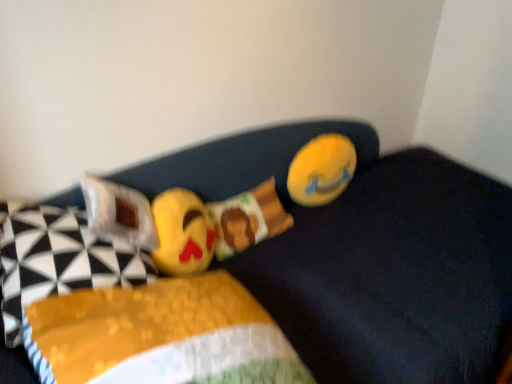
Where is `yellow fabric pillow at center`? The image size is (512, 384). yellow fabric pillow at center is located at coordinates pos(368,256).

Describe the element at coordinates (57, 260) in the screenshot. I see `yellow fabric pillow at left, which is counted as the 2th pillow, starting from the right` at that location.

Where is `yellow fabric pillow at left, marked as the 1th pillow in a left-to-right arrangement`? This screenshot has height=384, width=512. yellow fabric pillow at left, marked as the 1th pillow in a left-to-right arrangement is located at coordinates (57, 260).

At what (x,y) coordinates should I click in order to perform the action: click on yellow fabric pillow at center. Please return your answer as a coordinate pair (x, y). This screenshot has height=384, width=512. Looking at the image, I should click on (368, 256).

Is yellow fabric pillow at left, which is counted as the 2th pillow, starting from the right, next to yellow fabric pillow at center?

No, yellow fabric pillow at left, which is counted as the 2th pillow, starting from the right, is not with yellow fabric pillow at center.

From a real-world perspective, is yellow fabric pillow at left, marked as the 1th pillow in a left-to-right arrangement, under yellow fabric pillow at center?

Actually, yellow fabric pillow at left, marked as the 1th pillow in a left-to-right arrangement, is physically above yellow fabric pillow at center in the real world.

Considering the relative positions of yellow fabric pillow at left, which is counted as the 2th pillow, starting from the right, and yellow fabric pillow at center in the image provided, is yellow fabric pillow at left, which is counted as the 2th pillow, starting from the right, behind yellow fabric pillow at center?

Yes.

Is yellow fabric pillow at left, marked as the 1th pillow in a left-to-right arrangement, located outside yellow fabric pillow at center?

Actually, yellow fabric pillow at left, marked as the 1th pillow in a left-to-right arrangement, is within yellow fabric pillow at center.

Is soft plush emoji at center, which is the 2th toy in right-to-left order, not close to white fabric pillow at left, marked as the 1th pillow in a right-to-left arrangement?

Actually, soft plush emoji at center, which is the 2th toy in right-to-left order, and white fabric pillow at left, marked as the 1th pillow in a right-to-left arrangement, are a little close together.

From the image's perspective, which one is positioned higher, soft plush emoji at center, which is the 2th toy in right-to-left order, or white fabric pillow at left, marked as the 1th pillow in a right-to-left arrangement?

white fabric pillow at left, marked as the 1th pillow in a right-to-left arrangement, from the image's perspective.

Based on the photo, can you tell me how much soft plush emoji at center, the second toy positioned from the back, and white fabric pillow at left, which is counted as the 2th pillow, starting from the left, differ in facing direction?

The facing directions of soft plush emoji at center, the second toy positioned from the back, and white fabric pillow at left, which is counted as the 2th pillow, starting from the left, are 71.8 degrees apart.

From the picture: Which is correct: soft plush emoji at center, the second toy positioned from the back, is inside white fabric pillow at left, which is counted as the 2th pillow, starting from the left, or outside of it?

soft plush emoji at center, the second toy positioned from the back, is not inside white fabric pillow at left, which is counted as the 2th pillow, starting from the left, it's outside.

From a real-world perspective, is white fabric pillow at left, which is counted as the 2th pillow, starting from the left, positioned under yellow fabric pillow at left, marked as the 1th pillow in a left-to-right arrangement, based on gravity?

Incorrect, from a real-world perspective, white fabric pillow at left, which is counted as the 2th pillow, starting from the left, is higher than yellow fabric pillow at left, marked as the 1th pillow in a left-to-right arrangement.

Is white fabric pillow at left, which is counted as the 2th pillow, starting from the left, oriented away from yellow fabric pillow at left, marked as the 1th pillow in a left-to-right arrangement?

Yes, white fabric pillow at left, which is counted as the 2th pillow, starting from the left, is positioned with its back facing yellow fabric pillow at left, marked as the 1th pillow in a left-to-right arrangement.

Measure the distance between white fabric pillow at left, which is counted as the 2th pillow, starting from the left, and yellow fabric pillow at left, which is counted as the 2th pillow, starting from the right.

A distance of 4.38 inches exists between white fabric pillow at left, which is counted as the 2th pillow, starting from the left, and yellow fabric pillow at left, which is counted as the 2th pillow, starting from the right.

Does white fabric pillow at left, marked as the 1th pillow in a right-to-left arrangement, have a smaller size compared to yellow fabric pillow at left, marked as the 1th pillow in a left-to-right arrangement?

Indeed, white fabric pillow at left, marked as the 1th pillow in a right-to-left arrangement, has a smaller size compared to yellow fabric pillow at left, marked as the 1th pillow in a left-to-right arrangement.

Is soft plush emoji at center, which ranks as the 1th toy in left-to-right order, in front of yellow plush toy at upper right, acting as the 2th toy starting from the front?

Yes, it is in front of yellow plush toy at upper right, acting as the 2th toy starting from the front.

From the image's perspective, is soft plush emoji at center, which ranks as the 1th toy in left-to-right order, over yellow plush toy at upper right, which is the 2th toy in left-to-right order?

Incorrect, from the image's perspective, soft plush emoji at center, which ranks as the 1th toy in left-to-right order, is lower than yellow plush toy at upper right, which is the 2th toy in left-to-right order.

Which is correct: soft plush emoji at center, which ranks as the 1th toy in left-to-right order, is inside yellow plush toy at upper right, the first toy viewed from the right, or outside of it?

soft plush emoji at center, which ranks as the 1th toy in left-to-right order, exists outside the volume of yellow plush toy at upper right, the first toy viewed from the right.

From a real-world perspective, who is located lower, soft plush emoji at center, which is the 2th toy in right-to-left order, or yellow plush toy at upper right, which is the 2th toy in left-to-right order?

yellow plush toy at upper right, which is the 2th toy in left-to-right order.

Consider the image. From a real-world perspective, between yellow fabric pillow at center and yellow plush toy at upper right, the 1th toy viewed from the back, who is vertically higher?

yellow plush toy at upper right, the 1th toy viewed from the back.

From the image's perspective, which is above, yellow fabric pillow at center or yellow plush toy at upper right, which is the 2th toy in left-to-right order?

From the image's view, yellow plush toy at upper right, which is the 2th toy in left-to-right order, is above.

How different are the orientations of yellow fabric pillow at center and yellow plush toy at upper right, the 1th toy viewed from the back, in degrees?

93.4 degrees.

Based on the photo, who is bigger, yellow fabric pillow at center or yellow plush toy at upper right, the first toy viewed from the right?

With larger size is yellow fabric pillow at center.

In the scene shown: Is yellow fabric pillow at center positioned far away from soft plush emoji at center, which is the 2th toy in right-to-left order?

No, yellow fabric pillow at center is in close proximity to soft plush emoji at center, which is the 2th toy in right-to-left order.

Is soft plush emoji at center, the second toy positioned from the back, at the back of yellow fabric pillow at center?

yellow fabric pillow at center does not have its back to soft plush emoji at center, the second toy positioned from the back.

From a real-world perspective, who is located lower, yellow fabric pillow at center or soft plush emoji at center, positioned as the 1th toy in front-to-back order?

From a 3D spatial view, yellow fabric pillow at center is below.

Which object is thinner, yellow fabric pillow at center or soft plush emoji at center, positioned as the 1th toy in front-to-back order?

soft plush emoji at center, positioned as the 1th toy in front-to-back order, is thinner.

Are yellow fabric pillow at left, marked as the 1th pillow in a left-to-right arrangement, and soft plush emoji at center, which ranks as the 1th toy in left-to-right order, far apart?

No, yellow fabric pillow at left, marked as the 1th pillow in a left-to-right arrangement, is in close proximity to soft plush emoji at center, which ranks as the 1th toy in left-to-right order.

Consider the image. Which object is further away from the camera taking this photo, yellow fabric pillow at left, marked as the 1th pillow in a left-to-right arrangement, or soft plush emoji at center, which is the 2th toy in right-to-left order?

soft plush emoji at center, which is the 2th toy in right-to-left order.

From the image's perspective, between yellow fabric pillow at left, marked as the 1th pillow in a left-to-right arrangement, and soft plush emoji at center, positioned as the 1th toy in front-to-back order, who is located below?

yellow fabric pillow at left, marked as the 1th pillow in a left-to-right arrangement, from the image's perspective.

Is yellow fabric pillow at left, which is counted as the 2th pillow, starting from the right, facing towards soft plush emoji at center, the second toy positioned from the back?

Yes, yellow fabric pillow at left, which is counted as the 2th pillow, starting from the right, is turned towards soft plush emoji at center, the second toy positioned from the back.

This screenshot has height=384, width=512. I want to click on furniture on the right of the yellow fabric pillow at left, which is counted as the 2th pillow, starting from the right, so click(x=368, y=256).

Where is `toy below the white fabric pillow at left, which is counted as the 2th pillow, starting from the left (from the image's perspective)`? toy below the white fabric pillow at left, which is counted as the 2th pillow, starting from the left (from the image's perspective) is located at coordinates (182, 233).

From the image, which object appears to be farther from yellow fabric pillow at left, which is counted as the 2th pillow, starting from the right, soft plush emoji at center, positioned as the 1th toy in front-to-back order, or white fabric pillow at left, which is counted as the 2th pillow, starting from the left?

soft plush emoji at center, positioned as the 1th toy in front-to-back order.

From the image, which object appears to be farther from white fabric pillow at left, which is counted as the 2th pillow, starting from the left, yellow fabric pillow at left, marked as the 1th pillow in a left-to-right arrangement, or yellow plush toy at upper right, the 1th toy viewed from the back?

yellow plush toy at upper right, the 1th toy viewed from the back, is further to white fabric pillow at left, which is counted as the 2th pillow, starting from the left.

From the image, which object appears to be farther from white fabric pillow at left, which is counted as the 2th pillow, starting from the left, yellow plush toy at upper right, the 1th toy viewed from the back, or yellow fabric pillow at center?

The object further to white fabric pillow at left, which is counted as the 2th pillow, starting from the left, is yellow plush toy at upper right, the 1th toy viewed from the back.

Considering their positions, is yellow fabric pillow at center positioned further to yellow plush toy at upper right, the first toy viewed from the right, than yellow fabric pillow at left, which is counted as the 2th pillow, starting from the right?

yellow fabric pillow at left, which is counted as the 2th pillow, starting from the right.

Which object lies nearer to the anchor point white fabric pillow at left, marked as the 1th pillow in a right-to-left arrangement, yellow fabric pillow at center or soft plush emoji at center, positioned as the 1th toy in front-to-back order?

Based on the image, soft plush emoji at center, positioned as the 1th toy in front-to-back order, appears to be nearer to white fabric pillow at left, marked as the 1th pillow in a right-to-left arrangement.

Which object lies further to the anchor point white fabric pillow at left, which is counted as the 2th pillow, starting from the left, soft plush emoji at center, positioned as the 1th toy in front-to-back order, or yellow plush toy at upper right, the 1th toy viewed from the back?

Based on the image, yellow plush toy at upper right, the 1th toy viewed from the back, appears to be further to white fabric pillow at left, which is counted as the 2th pillow, starting from the left.

Consider the image. Which object lies further to the anchor point yellow fabric pillow at center, soft plush emoji at center, which ranks as the 1th toy in left-to-right order, or yellow fabric pillow at left, marked as the 1th pillow in a left-to-right arrangement?

Among the two, yellow fabric pillow at left, marked as the 1th pillow in a left-to-right arrangement, is located further to yellow fabric pillow at center.

When comparing their distances from soft plush emoji at center, positioned as the 1th toy in front-to-back order, does white fabric pillow at left, marked as the 1th pillow in a right-to-left arrangement, or yellow plush toy at upper right, which is the 2th toy in left-to-right order, seem further?

The object further to soft plush emoji at center, positioned as the 1th toy in front-to-back order, is yellow plush toy at upper right, which is the 2th toy in left-to-right order.

Identify the location of pillow between yellow fabric pillow at left, marked as the 1th pillow in a left-to-right arrangement, and soft plush emoji at center, which ranks as the 1th toy in left-to-right order, along the z-axis. click(118, 213).

I want to click on toy between yellow fabric pillow at center and yellow plush toy at upper right, the 1th toy viewed from the back, along the z-axis, so click(x=182, y=233).

At what (x,y) coordinates should I click in order to perform the action: click on pillow situated between yellow fabric pillow at left, marked as the 1th pillow in a left-to-right arrangement, and yellow plush toy at upper right, the 1th toy viewed from the back, from left to right. Please return your answer as a coordinate pair (x, y). Looking at the image, I should click on (118, 213).

What are the coordinates of `toy located between yellow fabric pillow at left, marked as the 1th pillow in a left-to-right arrangement, and yellow plush toy at upper right, which is the 2th toy in left-to-right order, in the depth direction` in the screenshot? It's located at (182, 233).